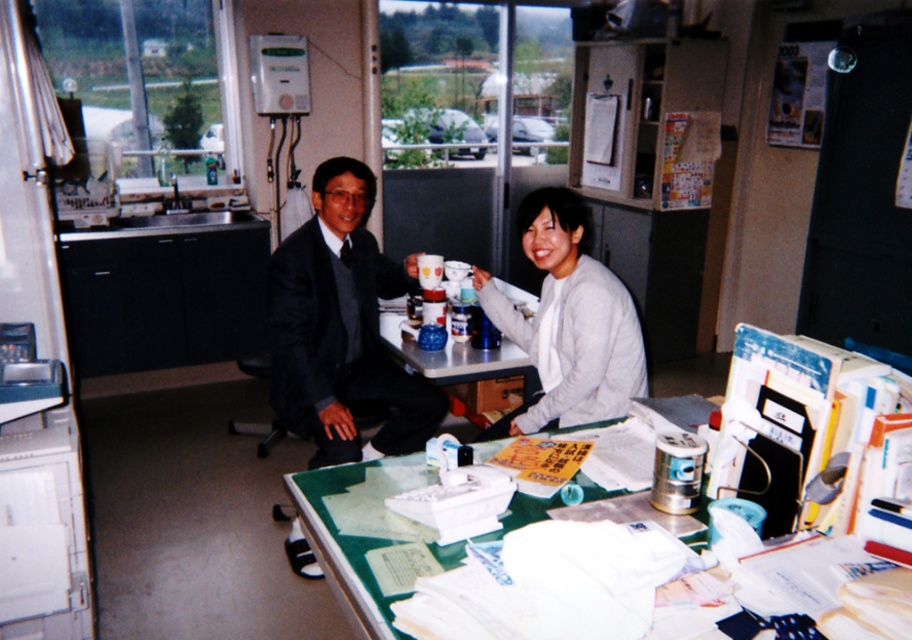
Question: Does matte black suit at center appear on the right side of matte plastic table at center?

Choices:
 (A) no
 (B) yes

Answer: (A)

Question: Does dark gray suit at center have a larger size compared to green glass table at center?

Choices:
 (A) yes
 (B) no

Answer: (A)

Question: Which point is farther to the camera?

Choices:
 (A) matte black suit at center
 (B) green glass table at center

Answer: (A)

Question: Where is matte black suit at center located in relation to light gray sweater at center in the image?

Choices:
 (A) below
 (B) above

Answer: (A)

Question: Which point appears farthest from the camera in this image?

Choices:
 (A) (309, 429)
 (B) (493, 296)
 (C) (416, 371)

Answer: (C)

Question: Considering the real-world distances, which object is farthest from the dark gray suit at center?

Choices:
 (A) light gray sweater at center
 (B) green glass table at center
 (C) matte black suit at center
 (D) matte plastic table at center

Answer: (B)